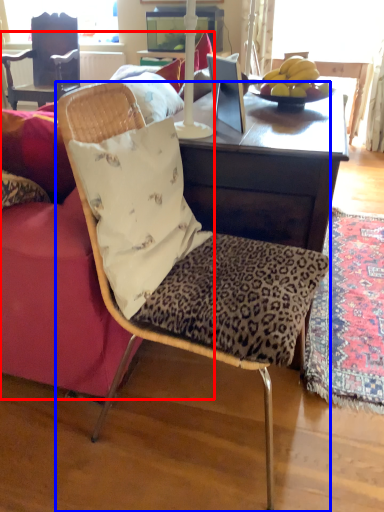
Question: Which object appears farthest to the camera in this image, studio couch (highlighted by a red box) or chair (highlighted by a blue box)?

Choices:
 (A) studio couch
 (B) chair

Answer: (A)